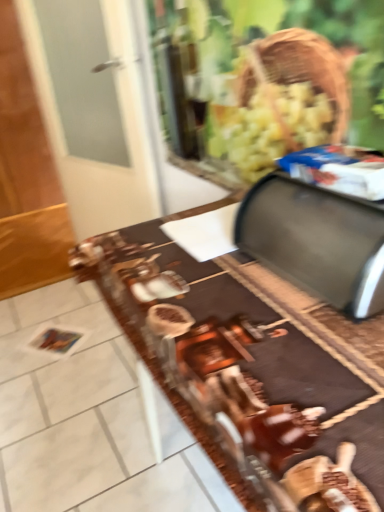
Question: From the image's perspective, relative to satin silver breadbox at upper right, is brown glossy table at center above or below?

Choices:
 (A) above
 (B) below

Answer: (B)

Question: From a real-world perspective, is brown glossy table at center physically located above or below satin silver breadbox at upper right?

Choices:
 (A) below
 (B) above

Answer: (A)

Question: Which is correct: brown glossy table at center is inside satin silver breadbox at upper right, or outside of it?

Choices:
 (A) inside
 (B) outside

Answer: (B)

Question: From a real-world perspective, is satin silver breadbox at upper right positioned above or below brown glossy table at center?

Choices:
 (A) above
 (B) below

Answer: (A)

Question: Visually, is satin silver breadbox at upper right positioned to the left or to the right of brown glossy table at center?

Choices:
 (A) right
 (B) left

Answer: (A)

Question: Considering their positions, is satin silver breadbox at upper right located in front of or behind brown glossy table at center?

Choices:
 (A) front
 (B) behind

Answer: (B)

Question: Is point (355, 258) positioned closer to the camera than point (291, 355)?

Choices:
 (A) farther
 (B) closer

Answer: (A)